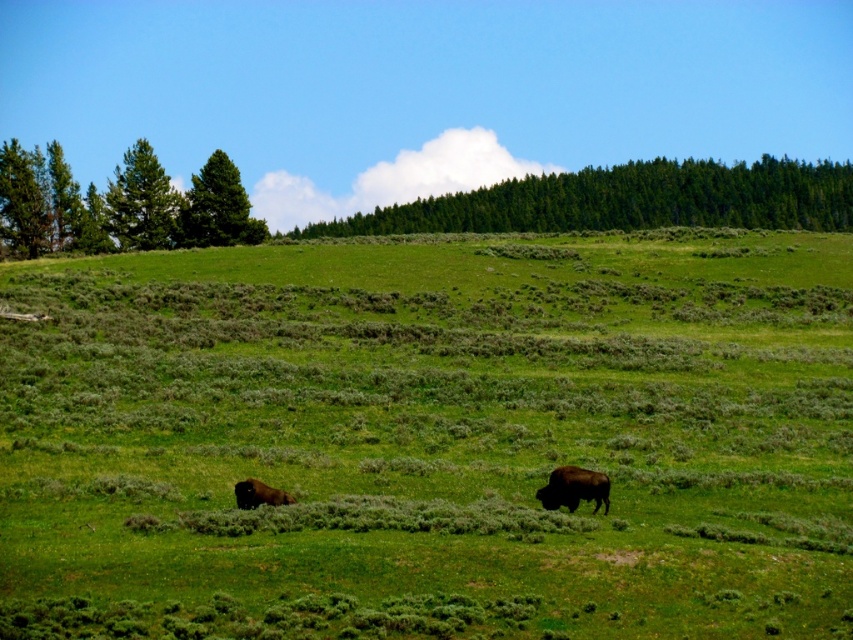
Question: Does green leafy trees at upper center have a smaller size compared to green coniferous trees at left?

Choices:
 (A) no
 (B) yes

Answer: (A)

Question: Which object is the farthest from the brown furry bison at lower right?

Choices:
 (A) green grassy field at center
 (B) green coniferous trees at left
 (C) green leafy trees at upper center
 (D) brown furry bison at lower center

Answer: (C)

Question: Is green coniferous trees at left positioned before brown furry bison at lower center?

Choices:
 (A) no
 (B) yes

Answer: (A)

Question: Is green grassy field at center smaller than green leafy trees at upper center?

Choices:
 (A) yes
 (B) no

Answer: (A)

Question: Which point is farther to the camera?

Choices:
 (A) (68, 504)
 (B) (222, 241)
 (C) (554, 468)

Answer: (B)

Question: Which is nearer to the green coniferous trees at left?

Choices:
 (A) green coniferous tree at upper left
 (B) green textured pine tree at upper left
 (C) brown furry bison at lower center

Answer: (A)